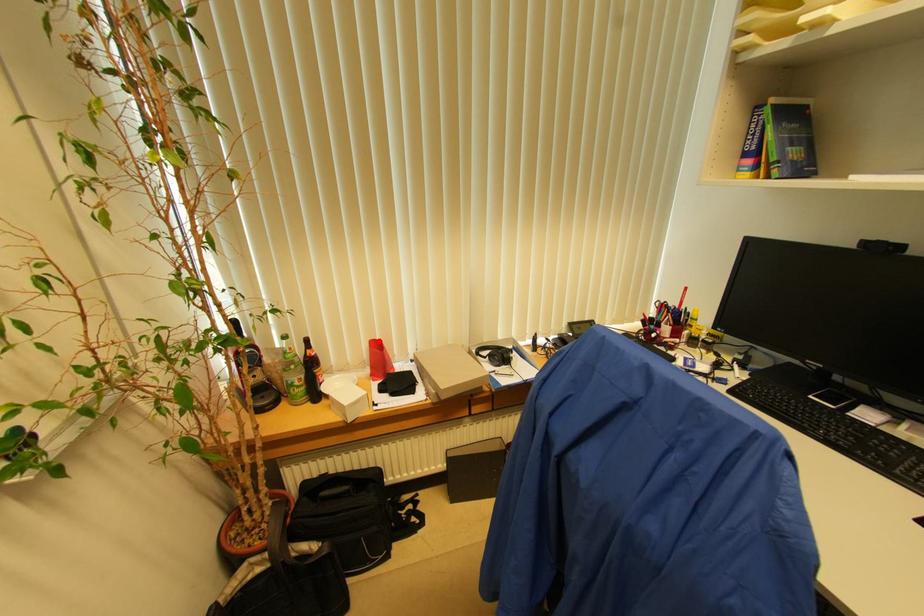
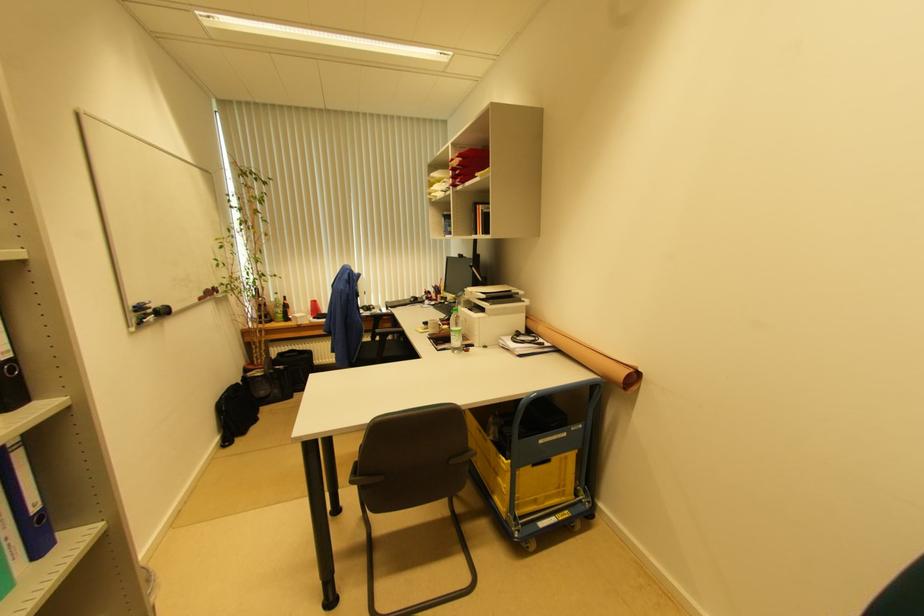
Question: I am providing you with two images of the same scene from different viewpoints. In image1, a red point is highlighted. Considering the same 3D point in image2, which of the following is correct?

Choices:
 (A) It is closer
 (B) It is farther

Answer: (B)